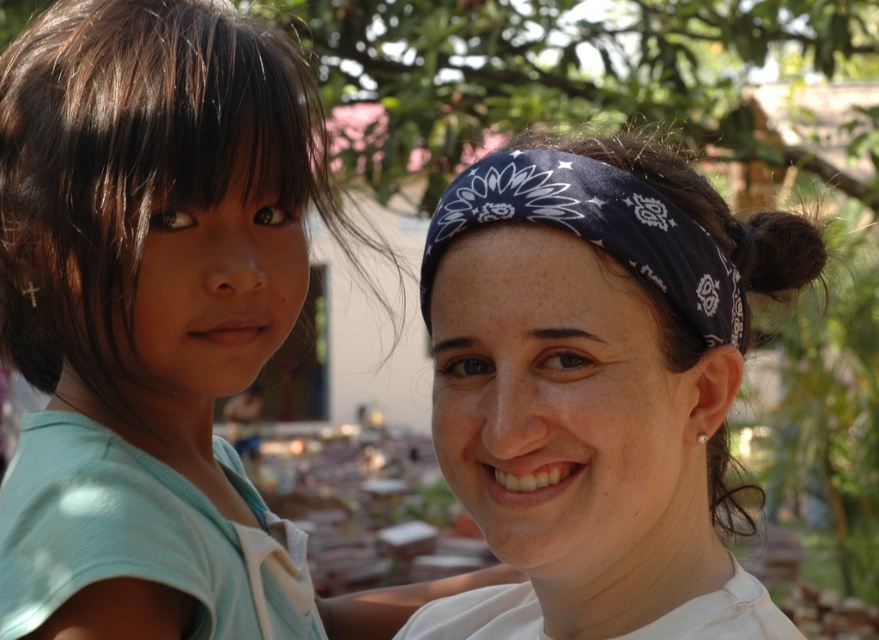
Question: Can you confirm if light blue fabric shirt at left is bigger than white cotton headband at upper right?

Choices:
 (A) yes
 (B) no

Answer: (A)

Question: Is light blue fabric shirt at left smaller than dark blue bandana at center?

Choices:
 (A) no
 (B) yes

Answer: (A)

Question: Which object is farther from the camera taking this photo?

Choices:
 (A) white cotton headband at upper right
 (B) dark blue bandana at center

Answer: (B)

Question: Which of the following is the farthest from the observer?

Choices:
 (A) (26, 141)
 (B) (509, 380)

Answer: (A)

Question: Does white cotton headband at upper right have a greater width compared to dark blue bandana at center?

Choices:
 (A) no
 (B) yes

Answer: (B)

Question: Among these points, which one is nearest to the camera?

Choices:
 (A) click(x=612, y=172)
 (B) click(x=103, y=580)
 (C) click(x=492, y=166)

Answer: (B)